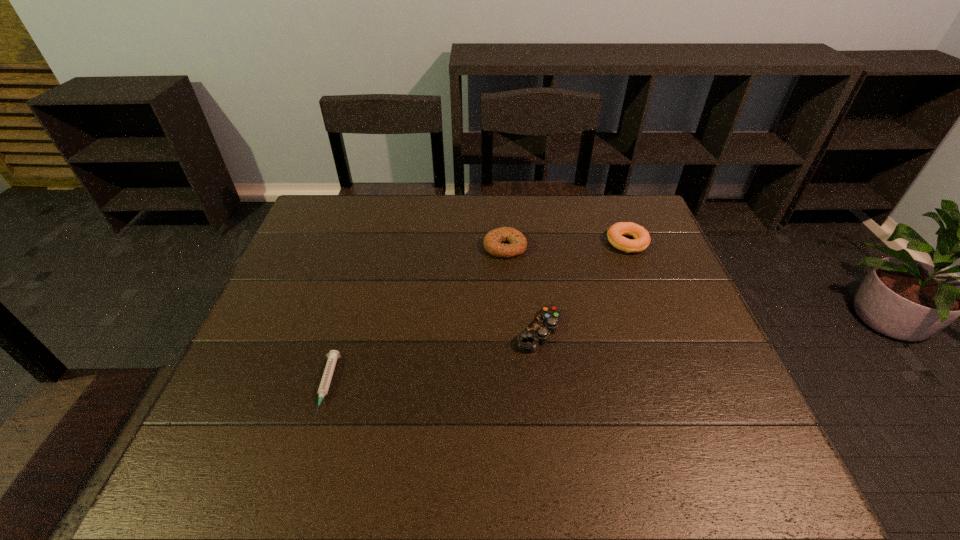
The image size is (960, 540). In order to click on object located in the right edge section of the desktop in this screenshot , I will do `click(615, 233)`.

At what (x,y) coordinates should I click in order to perform the action: click on object present at the far right corner. Please return your answer as a coordinate pair (x, y). This screenshot has height=540, width=960. Looking at the image, I should click on (x=615, y=233).

Identify the location of vacant space at the far edge. (544, 215).

Where is `vacant area at the near edge`? The height and width of the screenshot is (540, 960). vacant area at the near edge is located at coordinates (495, 485).

The height and width of the screenshot is (540, 960). What are the coordinates of `vacant space at the left edge` in the screenshot? It's located at (308, 261).

Find the location of a particular element. The width and height of the screenshot is (960, 540). vacant space at the right edge of the desktop is located at coordinates pos(696,359).

Identify the location of blank space at the far left corner of the desktop. (323, 218).

This screenshot has height=540, width=960. In order to click on free space at the near left corner of the desktop in this screenshot , I will do `click(196, 479)`.

This screenshot has height=540, width=960. What are the coordinates of `vacant space at the far right corner of the desktop` in the screenshot? It's located at coord(629,219).

The width and height of the screenshot is (960, 540). Identify the location of free space at the near right corner of the desktop. (761, 451).